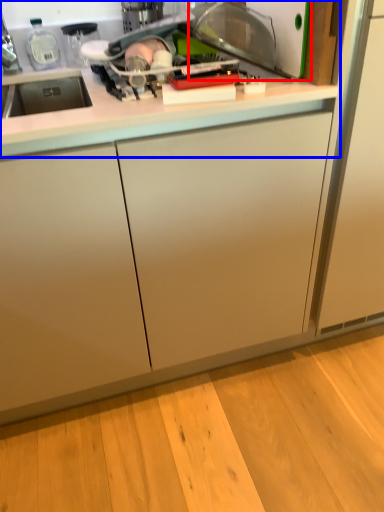
Question: Which point is further to the camera, appliance (highlighted by a red box) or countertop (highlighted by a blue box)?

Choices:
 (A) appliance
 (B) countertop

Answer: (A)